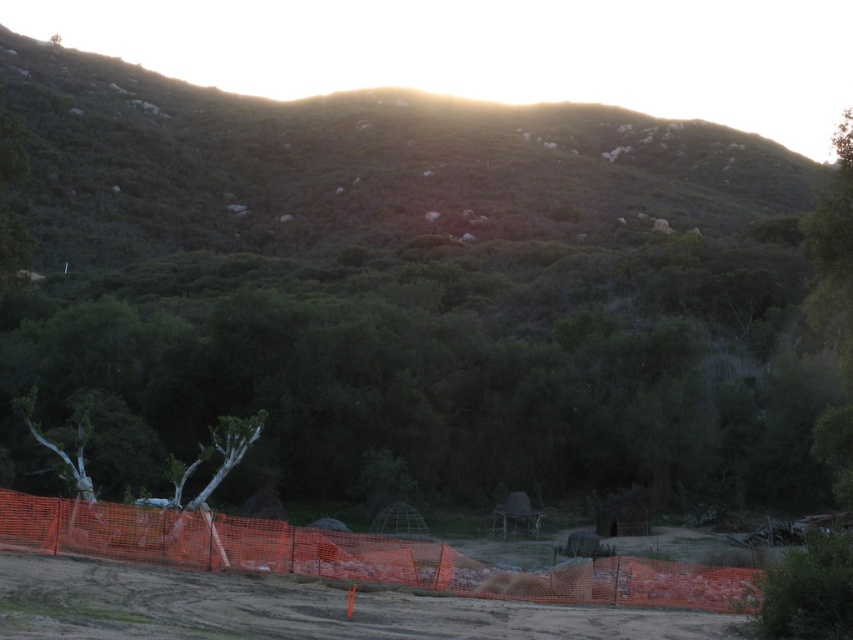
You are standing in the foreground of the scene, looking towards the fence and the greenery beyond. You notice two points marked in the image. Which of the two points, point (141, 612) or point (120, 531), is closer to your current position?

Point (141, 612) is closer to the camera than point (120, 531), so it is closer to your current position.